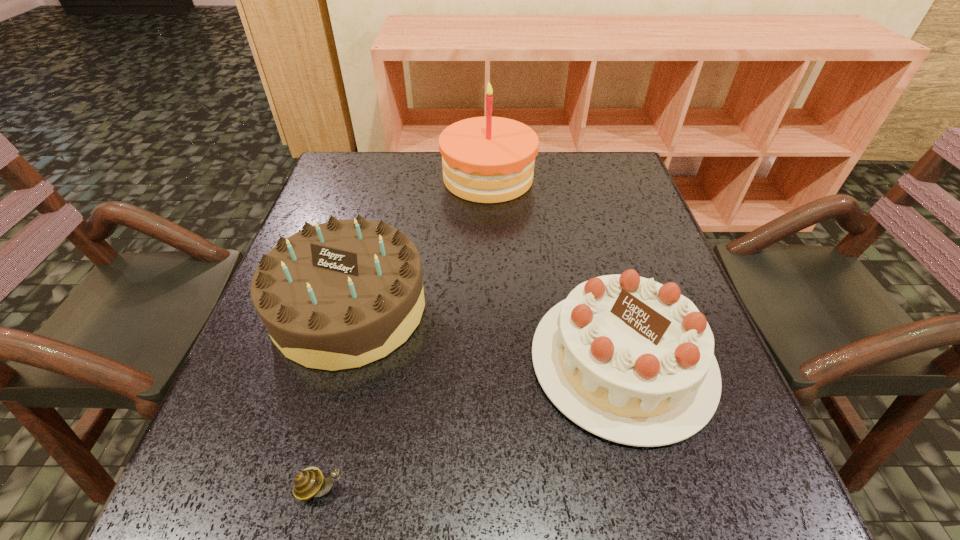
Where is `empty location between the leftmost birthday cake and the shortest object`? empty location between the leftmost birthday cake and the shortest object is located at coordinates (336, 398).

Select which object is the second closest to the shortest object. Please provide its 2D coordinates. Your answer should be formatted as a tuple, i.e. [(x, y)], where the tuple contains the x and y coordinates of a point satisfying the conditions above.

[(631, 360)]

Locate an element on the screen. object that stands as the third closest to the farthest birthday cake is located at coordinates (307, 484).

Image resolution: width=960 pixels, height=540 pixels. I want to click on birthday cake object that ranks as the second closest to the leftmost birthday cake, so click(x=631, y=360).

Identify the location of birthday cake that is the third closest to the nearest object. This screenshot has width=960, height=540. (487, 159).

What are the coordinates of `free location that satisfies the following two spatial constraints: 1. on the front side of the tallest object; 2. on the face of the snail` in the screenshot? It's located at (495, 488).